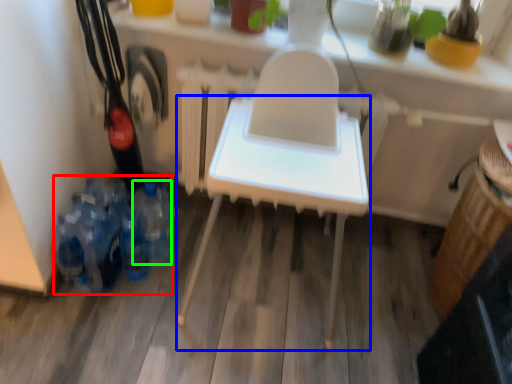
Question: Which object is positioned farthest from bottle (highlighted by a red box)? Select from furniture (highlighted by a blue box) and bottle (highlighted by a green box).

Choices:
 (A) furniture
 (B) bottle

Answer: (A)